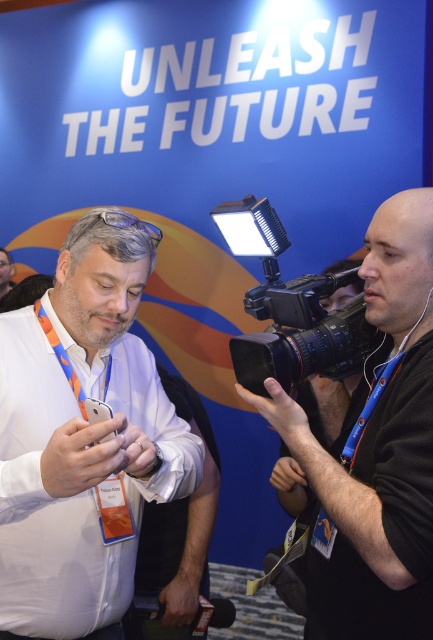
Between point (377, 256) and point (238, 372), which one is positioned in front?

Point (377, 256) is in front.

Is black matte camera at center wider than black plastic video camera at center?

In fact, black matte camera at center might be narrower than black plastic video camera at center.

The height and width of the screenshot is (640, 433). What do you see at coordinates (374, 448) in the screenshot?
I see `black matte camera at center` at bounding box center [374, 448].

Locate an element on the screen. This screenshot has width=433, height=640. black matte camera at center is located at coordinates (374, 448).

Is white matte shirt at center positioned in front of black plastic video camera at center?

Yes.

Who is positioned more to the left, white matte shirt at center or black plastic video camera at center?

white matte shirt at center

The image size is (433, 640). What are the coordinates of `white matte shirt at center` in the screenshot? It's located at (81, 435).

Image resolution: width=433 pixels, height=640 pixels. Identify the location of white matte shirt at center. (81, 435).

Who is positioned more to the right, white matte shirt at center or black matte camera at center?

black matte camera at center

Can you confirm if white matte shirt at center is taller than black matte camera at center?

In fact, white matte shirt at center may be shorter than black matte camera at center.

Between point (120, 454) and point (364, 493), which one is positioned in front?

Positioned in front is point (120, 454).

Identify the location of white matte shirt at center. The image size is (433, 640). (81, 435).